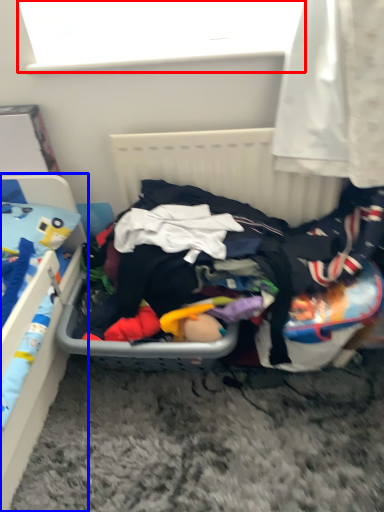
Question: Among these objects, which one is farthest to the camera, window screen (highlighted by a red box) or furniture (highlighted by a blue box)?

Choices:
 (A) window screen
 (B) furniture

Answer: (A)